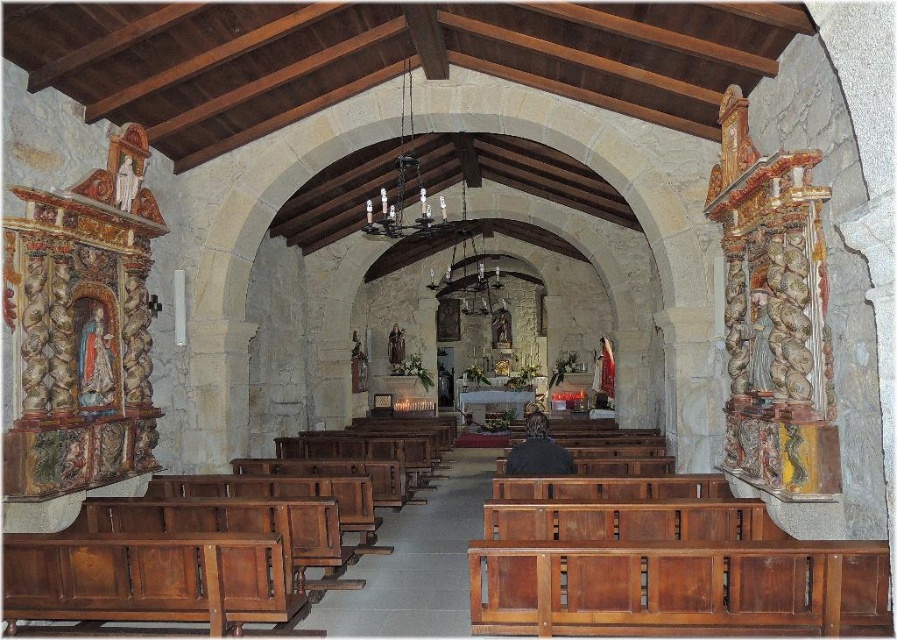
Which is in front, point (563, 630) or point (525, 476)?

Point (563, 630) is in front.

Can you confirm if wooden polished bench at lower center is positioned to the right of dark brown leather jacket at center?

Indeed, wooden polished bench at lower center is positioned on the right side of dark brown leather jacket at center.

At what (x,y) coordinates should I click in order to perform the action: click on wooden polished bench at lower center. Please return your answer as a coordinate pair (x, y). Looking at the image, I should click on (678, 588).

Is matte painted statue at left above matte white statue at left?

No, matte painted statue at left is not above matte white statue at left.

Who is more forward, (90, 317) or (120, 193)?

Point (90, 317) is more forward.

Where is `matte painted statue at left`? matte painted statue at left is located at coordinates 94,360.

Is wooden polished bench at lower center positioned in front of matte painted statue at left?

Yes.

Is point (685, 630) positioned in front of point (102, 368)?

Yes, it is in front of point (102, 368).

Identify the location of wooden polished bench at lower center. The image size is (897, 640). (678, 588).